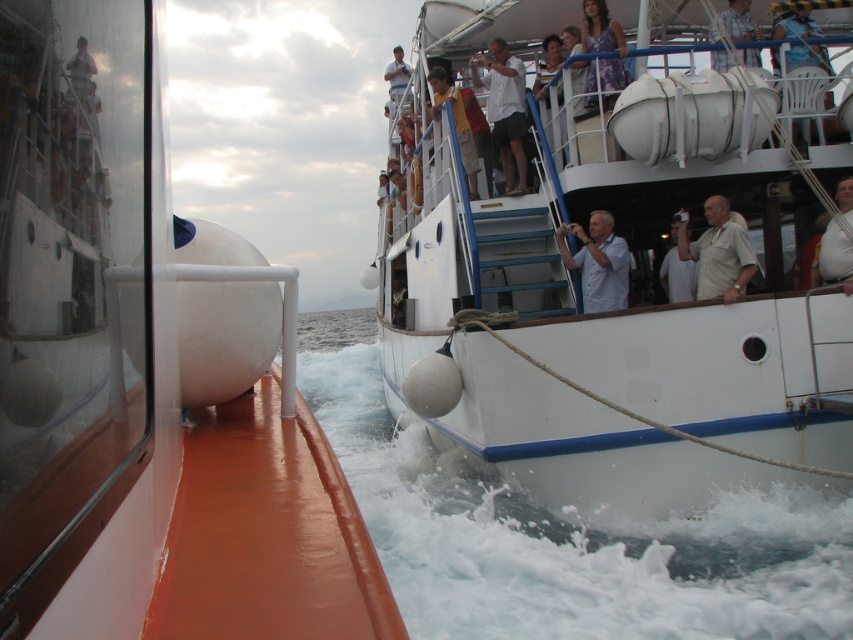
You are a photographer on the orange boat and want to take a photo of the two shirts at upper right on the white hull boat. Which shirt, the white cotton shirt at upper right or the white fabric shirt at upper right, will appear smaller in the photo?

The white cotton shirt at upper right will appear smaller in the photo because it is not as tall as the white fabric shirt at upper right.